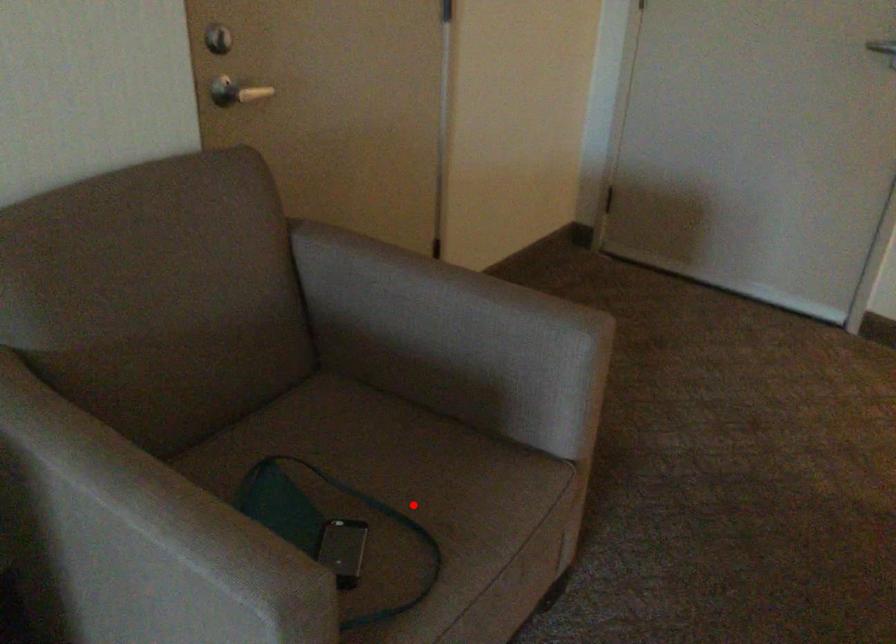
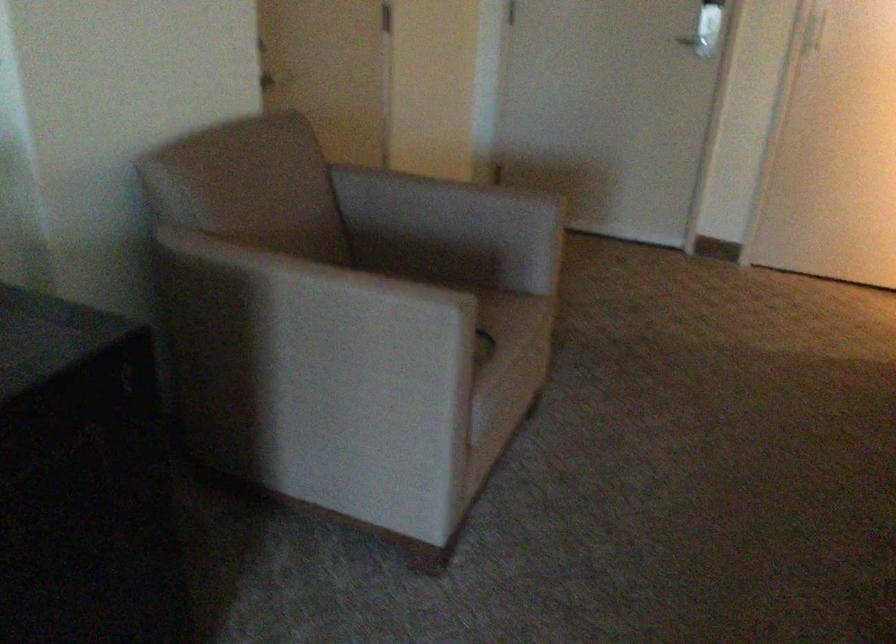
Question: I am providing you with two images of the same scene from different viewpoints. A red point is marked on the first image. Can you still see the location of the red point in image 2?

Choices:
 (A) Yes
 (B) No

Answer: (B)